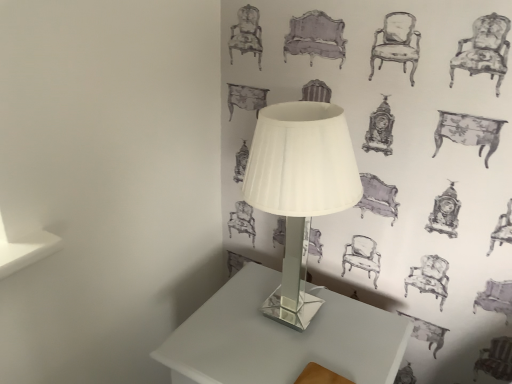
This screenshot has height=384, width=512. Find the location of `vacant region below white glass lamp at center (from a real-world perspective)`. vacant region below white glass lamp at center (from a real-world perspective) is located at coordinates (294, 316).